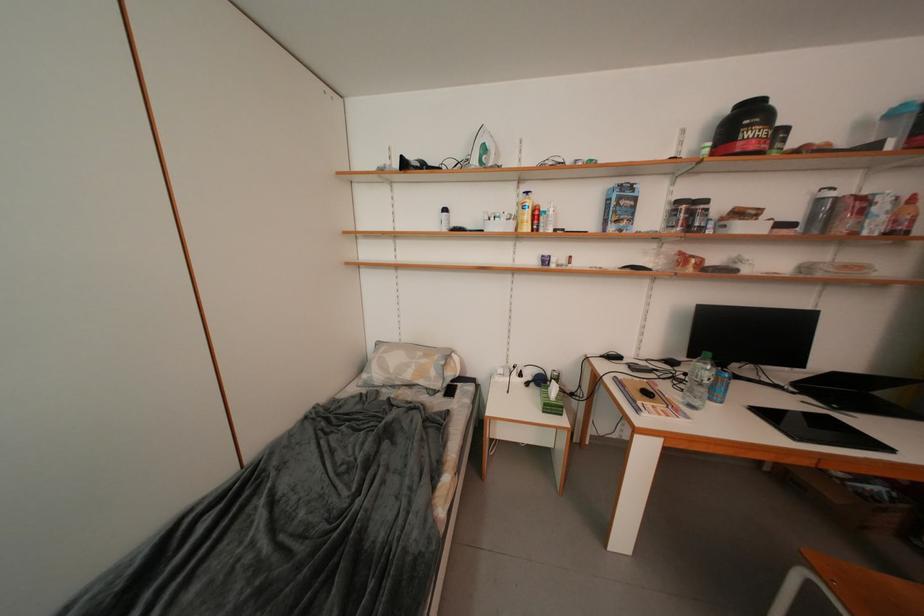
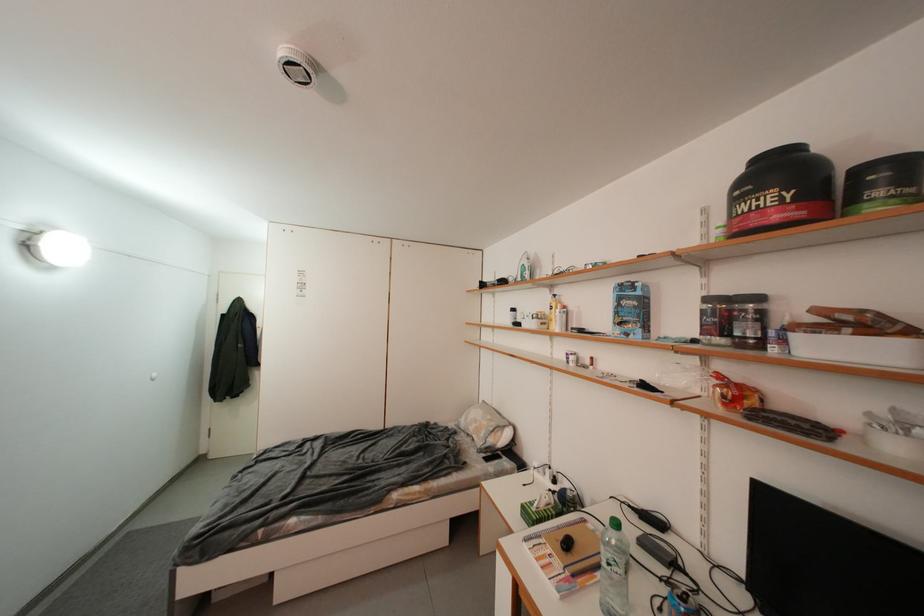
Where in the second image is the point corresponding to point 626,201 from the first image?

(627, 302)